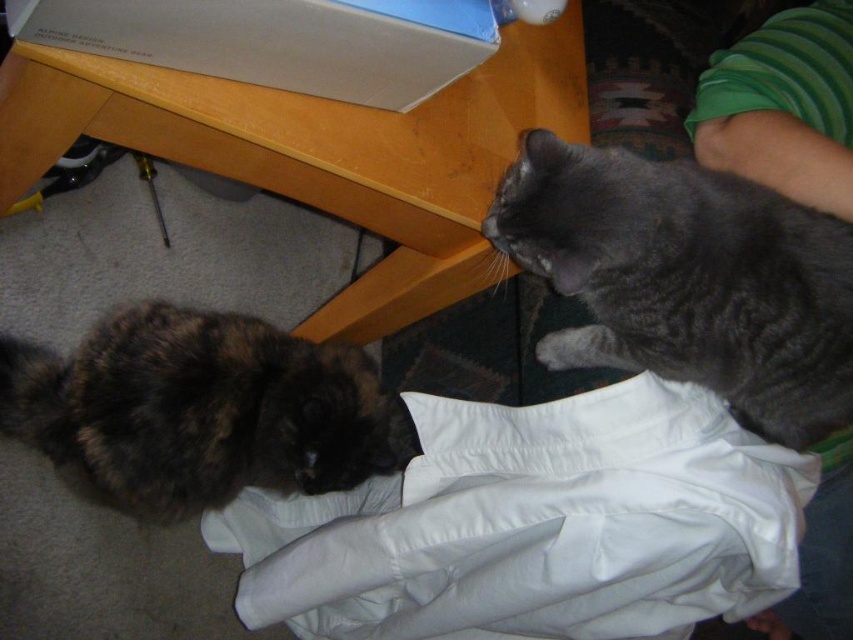
You are a cat owner who wants to place a water bowl on the wooden table at lower center. Considering the cats are in the foreground and on the right side, will the table be easily accessible for both cats to drink from?

The wooden table at lower center is located at point (320, 152), which is centrally positioned between the two cats. This placement ensures that both the tortoiseshell cat in the foreground and the gray tabby cat on the right can easily access the water bowl placed there.

You are a photographer trying to capture a closeup of the soft gray cat at lower right. Based on its position at point 0.822 on the x axis and 0.627 on the y axis, where should you aim your camera?

The soft gray cat at lower right is located at coordinates x 0.822 and y 0.627, so you should aim your camera towards the lower right area of the frame, specifically targeting the point at x 0.822 and y 0.627.